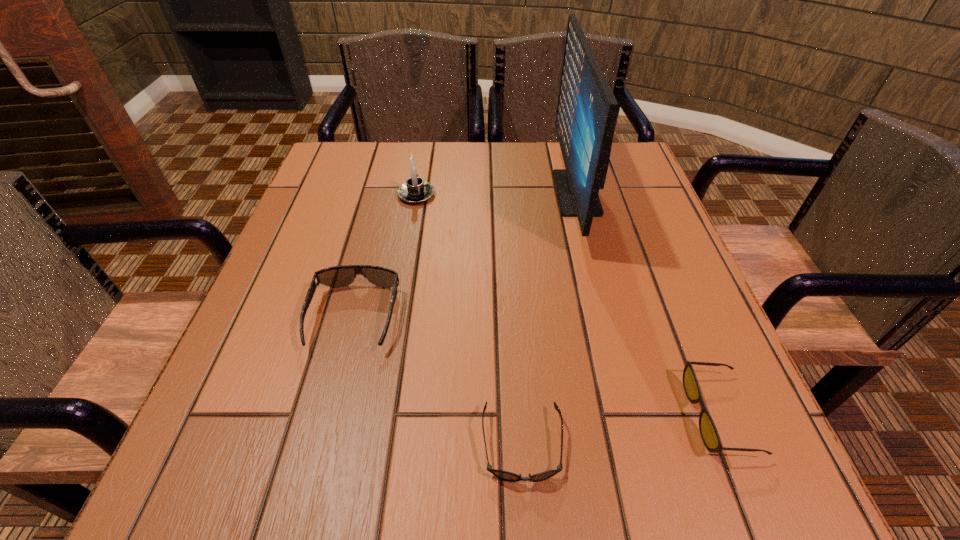
In the image, there is a desktop. At what (x,y) coordinates should I click in order to perform the action: click on vacant space at the far right corner. Please return your answer as a coordinate pair (x, y). Looking at the image, I should click on (613, 181).

Where is `vacant position at the near right corner of the desktop`? vacant position at the near right corner of the desktop is located at coordinates (773, 478).

Where is `free space between the computer monitor and the fourth shortest object`? The image size is (960, 540). free space between the computer monitor and the fourth shortest object is located at coordinates [x=496, y=194].

The height and width of the screenshot is (540, 960). I want to click on free space between the shortest sunglasses and the rightmost object, so click(620, 430).

Locate an element on the screen. vacant region between the third farthest object and the computer monitor is located at coordinates (466, 255).

At what (x,y) coordinates should I click in order to perform the action: click on vacant area that lies between the farthest sunglasses and the second shortest sunglasses. Please return your answer as a coordinate pair (x, y). Looking at the image, I should click on (537, 367).

The height and width of the screenshot is (540, 960). What are the coordinates of `free space between the third object from left to right and the fourth shortest object` in the screenshot? It's located at pyautogui.click(x=469, y=320).

Find the location of a particular element. unoccupied position between the computer monitor and the farthest sunglasses is located at coordinates (466, 255).

At what (x,y) coordinates should I click in order to perform the action: click on free spot between the shortest sunglasses and the candle holder. Please return your answer as a coordinate pair (x, y). The height and width of the screenshot is (540, 960). Looking at the image, I should click on (469, 320).

The height and width of the screenshot is (540, 960). In order to click on free space between the second shortest object and the shortest sunglasses in this screenshot , I will do `click(620, 430)`.